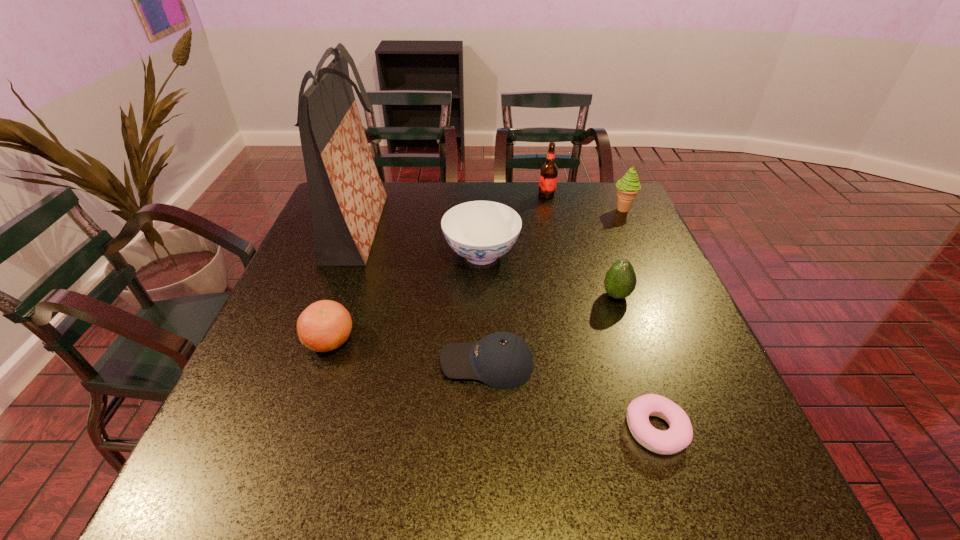
Find the location of `shopping bag located in the far edge section of the desktop`. shopping bag located in the far edge section of the desktop is located at coordinates (347, 197).

Find the location of a particular element. The image size is (960, 540). root beer positioned at the far edge is located at coordinates (548, 175).

Find the location of a particular element. icecream that is at the far edge is located at coordinates (627, 188).

At what (x,y) coordinates should I click in order to perform the action: click on object present at the near edge. Please return your answer as a coordinate pair (x, y). Looking at the image, I should click on [x=679, y=435].

The image size is (960, 540). What are the coordinates of `shopping bag situated at the left edge` in the screenshot? It's located at (347, 197).

Locate an element on the screen. clementine that is at the left edge is located at coordinates (325, 325).

Where is `icecream that is at the right edge`? Image resolution: width=960 pixels, height=540 pixels. icecream that is at the right edge is located at coordinates (627, 188).

The image size is (960, 540). What are the coordinates of `avocado that is positioned at the right edge` in the screenshot? It's located at (620, 281).

Where is `pastry that is at the right edge`? This screenshot has height=540, width=960. pastry that is at the right edge is located at coordinates (679, 435).

Identify the location of object that is at the far left corner. (347, 197).